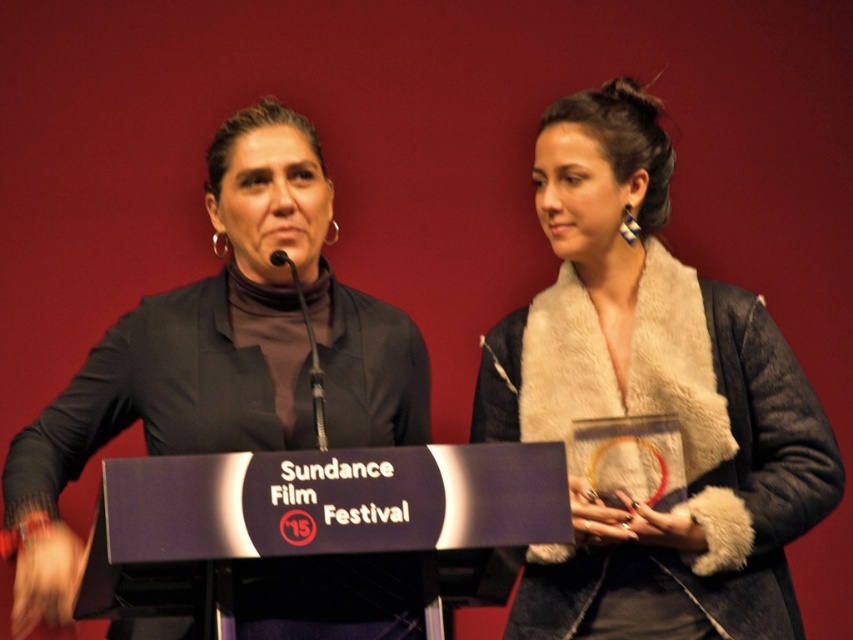
Is point (722, 364) closer to viewer compared to point (230, 164)?

No, (722, 364) is behind (230, 164).

Between point (555, 348) and point (213, 404), which one is positioned in front?

Positioned in front is point (213, 404).

Locate an element on the screen. The height and width of the screenshot is (640, 853). fuzzy white scarf at center is located at coordinates (653, 401).

Where is `fuzzy white scarf at center`? The width and height of the screenshot is (853, 640). fuzzy white scarf at center is located at coordinates (x=653, y=401).